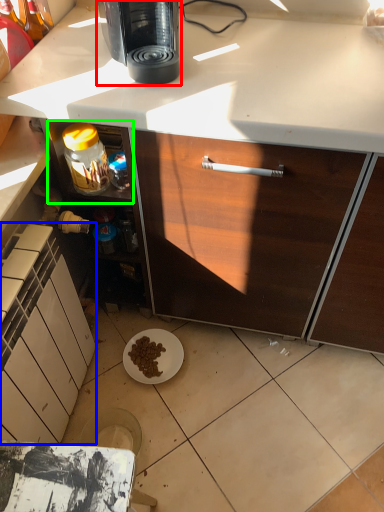
Question: Estimate the real-world distances between objects in this image. Which object is closer to coffee maker (highlighted by a red box), cabinetry (highlighted by a blue box) or shelf (highlighted by a green box)?

Choices:
 (A) cabinetry
 (B) shelf

Answer: (B)